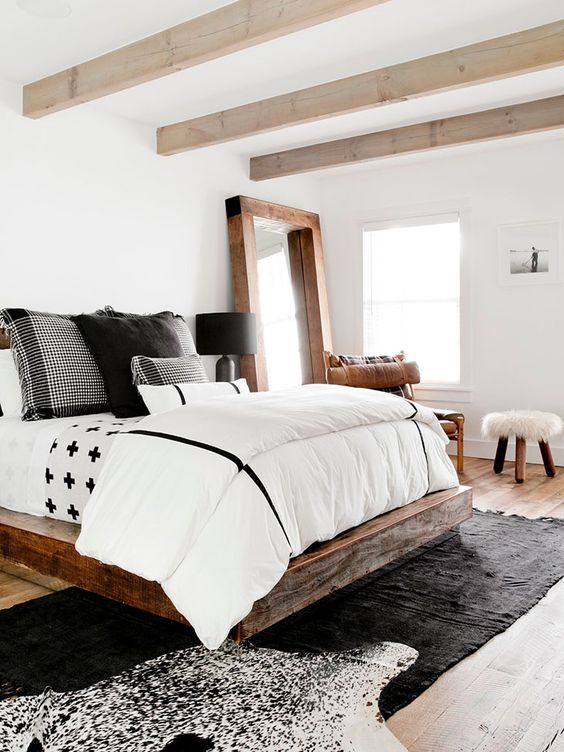
Locate an element on the screen. The height and width of the screenshot is (752, 564). mirror is located at coordinates (282, 304).